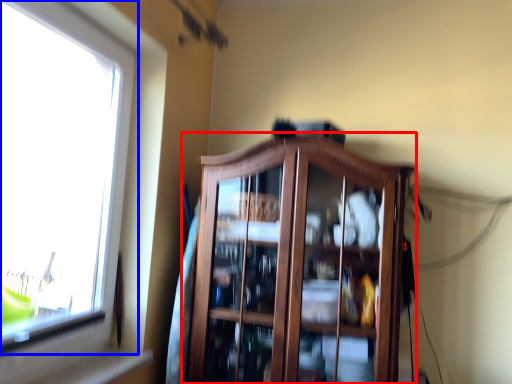
Question: Which point is further to the camera, dresser (highlighted by a red box) or window (highlighted by a blue box)?

Choices:
 (A) dresser
 (B) window

Answer: (A)